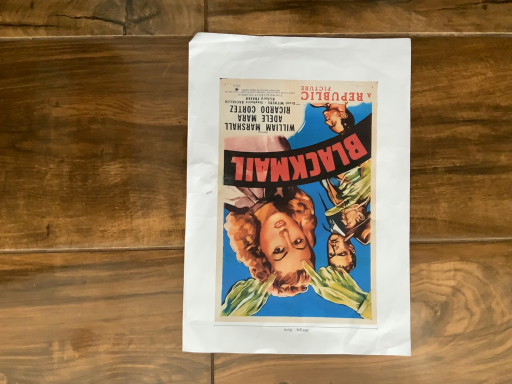
Where is `vivid paper poster at center`? vivid paper poster at center is located at coordinates (297, 196).

Describe the element at coordinates (297, 196) in the screenshot. This screenshot has width=512, height=384. I see `vivid paper poster at center` at that location.

Where is `vivid paper poster at center`? This screenshot has width=512, height=384. vivid paper poster at center is located at coordinates (297, 196).